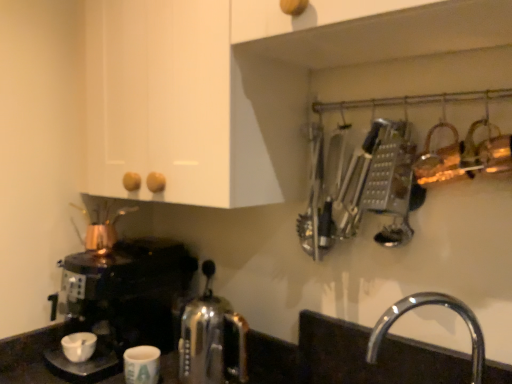
Question: Does chrome/metallic faucet at lower right have a greater width compared to metallic silver grater at upper right?

Choices:
 (A) yes
 (B) no

Answer: (A)

Question: Does chrome/metallic faucet at lower right appear on the left side of metallic silver grater at upper right?

Choices:
 (A) no
 (B) yes

Answer: (A)

Question: Can you confirm if chrome/metallic faucet at lower right is smaller than metallic silver grater at upper right?

Choices:
 (A) no
 (B) yes

Answer: (A)

Question: From a real-world perspective, does chrome/metallic faucet at lower right stand above metallic silver grater at upper right?

Choices:
 (A) no
 (B) yes

Answer: (A)

Question: Would you consider chrome/metallic faucet at lower right to be distant from metallic silver grater at upper right?

Choices:
 (A) no
 (B) yes

Answer: (A)

Question: Looking at their shapes, would you say white matte coffee cup at lower left, acting as the 1th coffee cup starting from the left, is wider or thinner than copper metallic tea pot at left?

Choices:
 (A) wide
 (B) thin

Answer: (B)

Question: Based on their positions, is white matte coffee cup at lower left, which appears as the second coffee cup when viewed from the right, located to the left or right of copper metallic tea pot at left?

Choices:
 (A) right
 (B) left

Answer: (B)

Question: In the image, is white matte coffee cup at lower left, which appears as the second coffee cup when viewed from the right, positioned in front of or behind copper metallic tea pot at left?

Choices:
 (A) front
 (B) behind

Answer: (A)

Question: From a real-world perspective, is white matte coffee cup at lower left, which appears as the second coffee cup when viewed from the right, physically located above or below copper metallic tea pot at left?

Choices:
 (A) below
 (B) above

Answer: (A)

Question: Looking at the image, does shiny black coffee maker at left seem bigger or smaller compared to metallic silver grater at upper right?

Choices:
 (A) small
 (B) big

Answer: (B)

Question: From a real-world perspective, is shiny black coffee maker at left physically located above or below metallic silver grater at upper right?

Choices:
 (A) below
 (B) above

Answer: (A)

Question: Is shiny black coffee maker at left to the left or to the right of metallic silver grater at upper right in the image?

Choices:
 (A) right
 (B) left

Answer: (B)

Question: Is point (128, 307) closer or farther from the camera than point (378, 120)?

Choices:
 (A) farther
 (B) closer

Answer: (A)

Question: Is white matte coffee cup at lower left, which appears as the second coffee cup when viewed from the right, bigger or smaller than shiny black coffee maker at left?

Choices:
 (A) small
 (B) big

Answer: (A)

Question: From a real-world perspective, is white matte coffee cup at lower left, which appears as the second coffee cup when viewed from the right, physically located above or below shiny black coffee maker at left?

Choices:
 (A) above
 (B) below

Answer: (B)